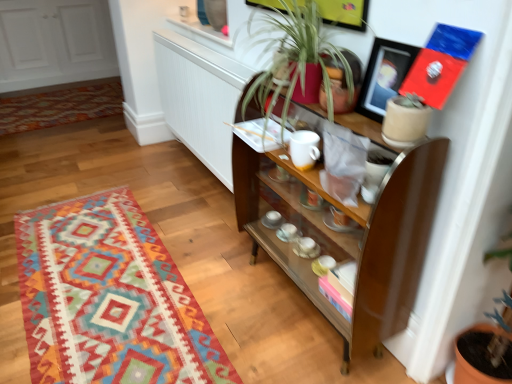
Where is `vacant area located to the right-hand side of textured wool rug at lower left, which ranks as the 1th mat in bottom-to-top order`? This screenshot has height=384, width=512. vacant area located to the right-hand side of textured wool rug at lower left, which ranks as the 1th mat in bottom-to-top order is located at coordinates (242, 286).